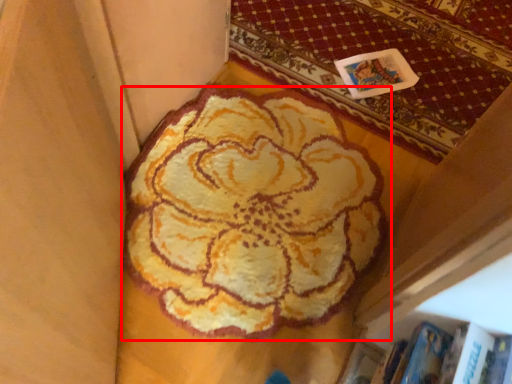
Question: From the image's perspective, where is flower (annotated by the red box) located in relation to mat in the image?

Choices:
 (A) above
 (B) below

Answer: (B)